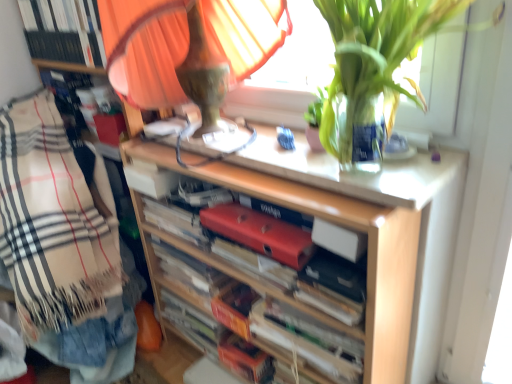
Locate an element on the screen. This screenshot has height=384, width=512. vacant space situated on the left part of red matte book at center, the third paperback book when ordered from bottom to top is located at coordinates tap(248, 216).